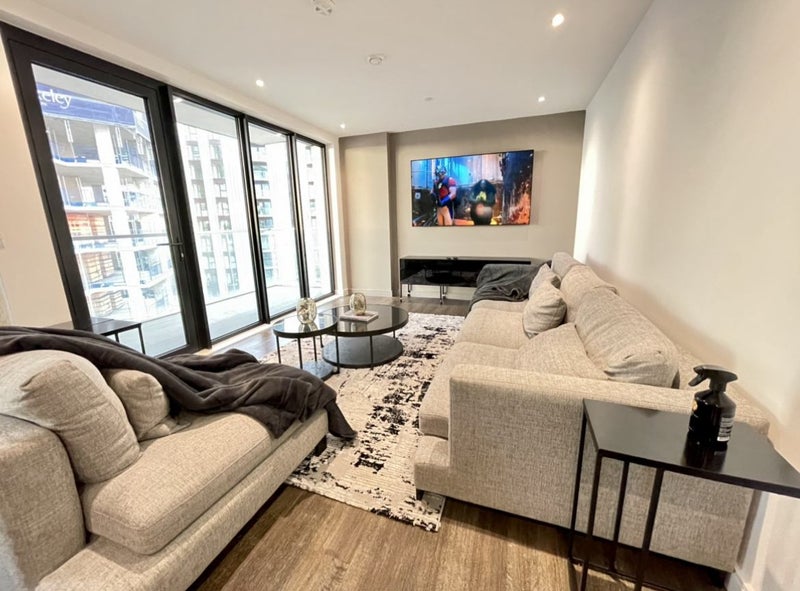
Image resolution: width=800 pixels, height=591 pixels. Identify the location of table. (361, 333).